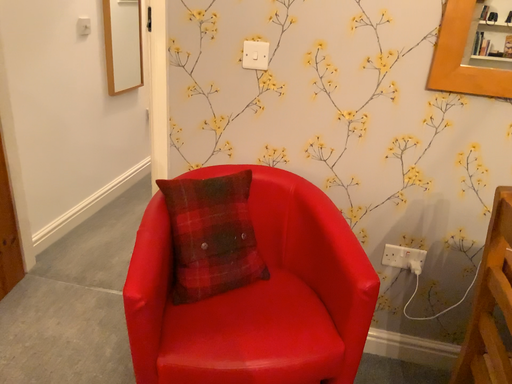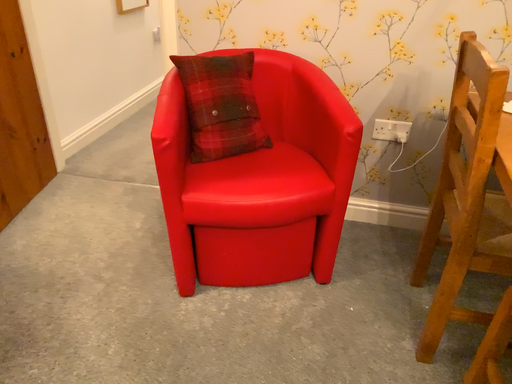
Question: How did the camera likely rotate when shooting the video?

Choices:
 (A) rotated upward
 (B) rotated downward

Answer: (B)